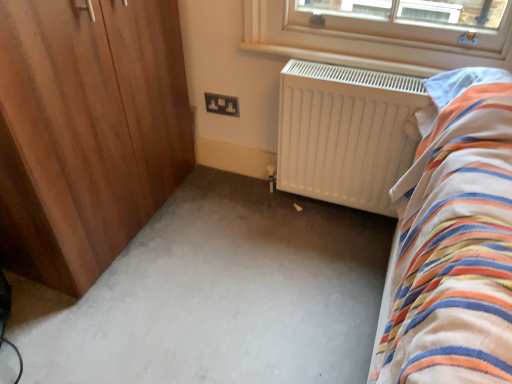
Question: Considering the relative sizes of wooden wardrobe at left and black plastic socket at center in the image provided, is wooden wardrobe at left wider than black plastic socket at center?

Choices:
 (A) yes
 (B) no

Answer: (A)

Question: Can you confirm if wooden wardrobe at left is thinner than black plastic socket at center?

Choices:
 (A) yes
 (B) no

Answer: (B)

Question: Can we say wooden wardrobe at left lies outside black plastic socket at center?

Choices:
 (A) yes
 (B) no

Answer: (A)

Question: Is wooden wardrobe at left further to camera compared to black plastic socket at center?

Choices:
 (A) no
 (B) yes

Answer: (A)

Question: Does wooden wardrobe at left appear on the right side of black plastic socket at center?

Choices:
 (A) no
 (B) yes

Answer: (A)

Question: From the image's perspective, is white matte radiator at center positioned above or below wooden wardrobe at left?

Choices:
 (A) below
 (B) above

Answer: (A)

Question: Would you say white matte radiator at center is to the left or to the right of wooden wardrobe at left in the picture?

Choices:
 (A) right
 (B) left

Answer: (A)

Question: From a real-world perspective, relative to wooden wardrobe at left, is white matte radiator at center vertically above or below?

Choices:
 (A) above
 (B) below

Answer: (B)

Question: In the image, is white matte radiator at center positioned in front of or behind wooden wardrobe at left?

Choices:
 (A) front
 (B) behind

Answer: (B)

Question: In terms of size, does black plastic socket at center appear bigger or smaller than wooden wardrobe at left?

Choices:
 (A) big
 (B) small

Answer: (B)

Question: Does point (218, 99) appear closer or farther from the camera than point (74, 254)?

Choices:
 (A) farther
 (B) closer

Answer: (A)

Question: From a real-world perspective, is black plastic socket at center physically located above or below wooden wardrobe at left?

Choices:
 (A) below
 (B) above

Answer: (A)

Question: Is black plastic socket at center taller or shorter than wooden wardrobe at left?

Choices:
 (A) tall
 (B) short

Answer: (B)

Question: Looking at the image, does wooden wardrobe at left seem bigger or smaller compared to black plastic socket at center?

Choices:
 (A) big
 (B) small

Answer: (A)

Question: Is wooden wardrobe at left wider or thinner than black plastic socket at center?

Choices:
 (A) thin
 (B) wide

Answer: (B)